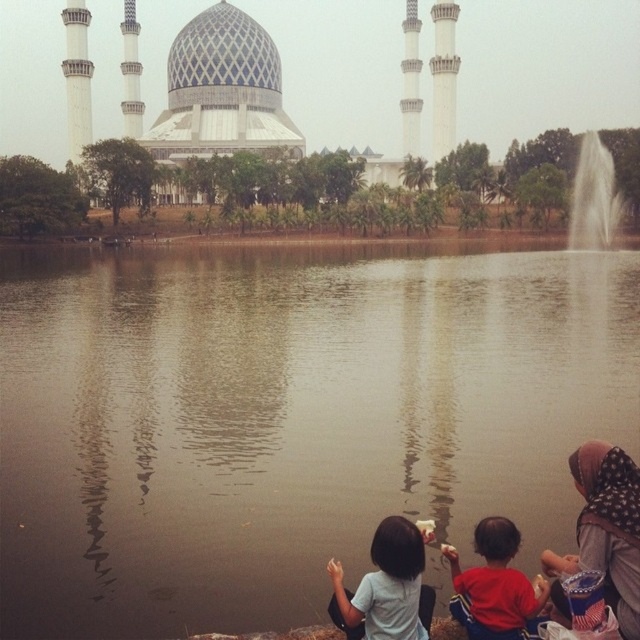
Based on the photo, which is more to the right, brown reflective water at center or matte gray children at lower center?

matte gray children at lower center

This screenshot has height=640, width=640. What do you see at coordinates (285, 419) in the screenshot? I see `brown reflective water at center` at bounding box center [285, 419].

This screenshot has height=640, width=640. I want to click on brown reflective water at center, so click(x=285, y=419).

Can you confirm if matte gray children at lower center is bigger than patterned fabric headscarf at lower right?

Yes.

Is matte gray children at lower center wider than patterned fabric headscarf at lower right?

Indeed, matte gray children at lower center has a greater width compared to patterned fabric headscarf at lower right.

Image resolution: width=640 pixels, height=640 pixels. What do you see at coordinates (605, 529) in the screenshot?
I see `matte gray children at lower center` at bounding box center [605, 529].

Where is `matte gray children at lower center`? The width and height of the screenshot is (640, 640). matte gray children at lower center is located at coordinates (605, 529).

This screenshot has width=640, height=640. What do you see at coordinates (605, 529) in the screenshot?
I see `patterned fabric headscarf at lower right` at bounding box center [605, 529].

Is patterned fabric headscarf at lower right taller than light blue fabric shirt at lower center?

Yes.

The image size is (640, 640). What do you see at coordinates (605, 529) in the screenshot? I see `patterned fabric headscarf at lower right` at bounding box center [605, 529].

What are the coordinates of `patterned fabric headscarf at lower right` in the screenshot? It's located at (605, 529).